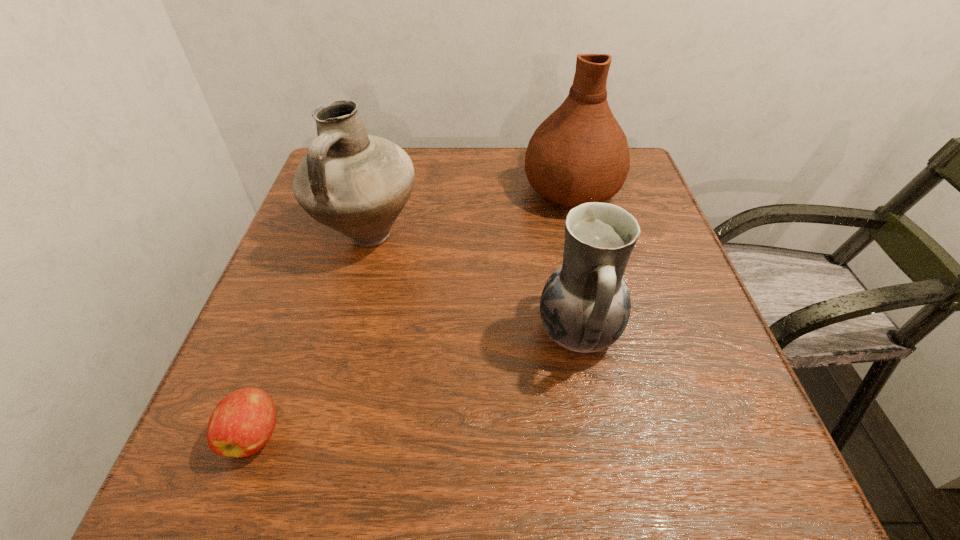
Locate an element on the screen. The width and height of the screenshot is (960, 540). vacant position at the right edge of the desktop is located at coordinates (665, 399).

The width and height of the screenshot is (960, 540). In the image, there is a desktop. What are the coordinates of `vacant space at the near left corner` in the screenshot? It's located at (239, 474).

At what (x,y) coordinates should I click in order to perform the action: click on vacant area at the far right corner. Please return your answer as a coordinate pair (x, y). Looking at the image, I should click on (632, 168).

Find the location of `free space between the second nearest object and the leftmost pitcher`. free space between the second nearest object and the leftmost pitcher is located at coordinates (x=473, y=284).

At what (x,y) coordinates should I click in order to perform the action: click on vacant space that's between the leftmost pitcher and the shortest pitcher. Please return your answer as a coordinate pair (x, y). The image size is (960, 540). Looking at the image, I should click on (473, 284).

I want to click on empty space between the nearest object and the leftmost pitcher, so click(x=311, y=335).

This screenshot has height=540, width=960. What are the coordinates of `vacant space in between the third tallest object and the leftmost pitcher` in the screenshot? It's located at (473, 284).

This screenshot has height=540, width=960. Identify the location of free spot between the shortest object and the leftmost pitcher. (311, 335).

You are a GUI agent. You are given a task and a screenshot of the screen. Output one action in this format:
    pyautogui.click(x=<x>, y=<y>)
    Task: Click on the closest object to the shortest pitcher
    The width and height of the screenshot is (960, 540).
    Given the screenshot: What is the action you would take?
    pyautogui.click(x=579, y=154)

Identify which object is the second closest to the nearest object. Please provide its 2D coordinates. Your answer should be formatted as a tuple, i.e. [(x, y)], where the tuple contains the x and y coordinates of a point satisfying the conditions above.

[(585, 305)]